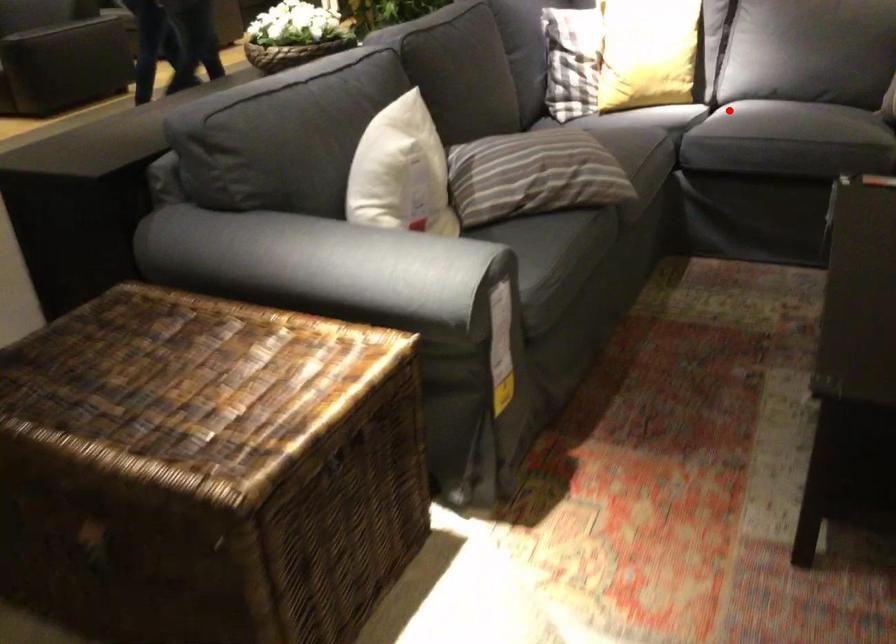
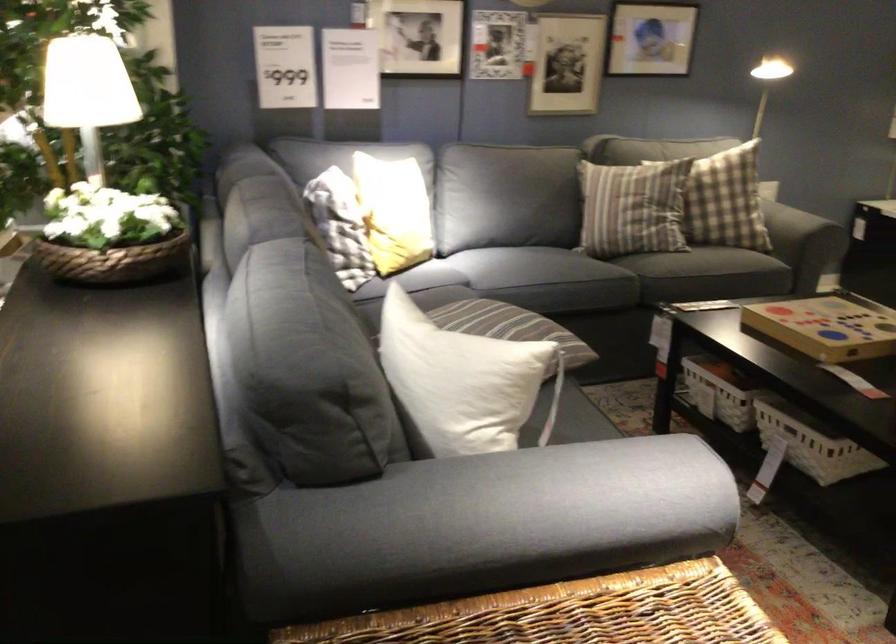
In the second image, find the point that corresponds to the highlighted location in the first image.

(538, 267)